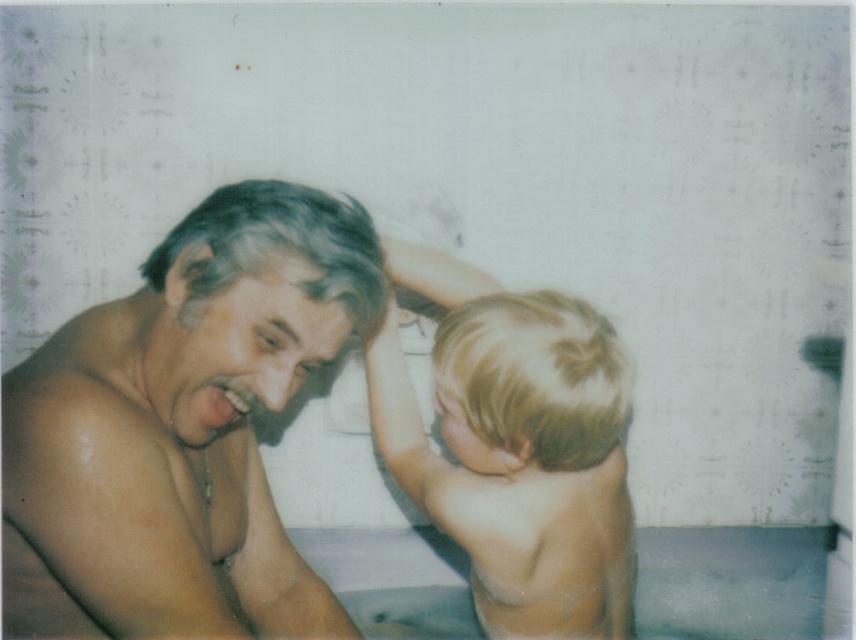
Question: Considering the real-world distances, which object is closest to the white smooth foam at lower center?

Choices:
 (A) smooth skin man at center
 (B) blonde hair at upper right

Answer: (B)

Question: Is blonde hair at upper right wider than white smooth foam at lower center?

Choices:
 (A) yes
 (B) no

Answer: (B)

Question: Can you confirm if blonde hair at upper right is positioned below white smooth foam at lower center?

Choices:
 (A) no
 (B) yes

Answer: (A)

Question: Among these points, which one is nearest to the camera?

Choices:
 (A) (597, 353)
 (B) (272, 541)

Answer: (A)

Question: Can you confirm if smooth skin man at center is thinner than blonde hair at upper right?

Choices:
 (A) yes
 (B) no

Answer: (A)

Question: Among these objects, which one is nearest to the camera?

Choices:
 (A) blonde hair at upper right
 (B) smooth skin man at center
 (C) white smooth foam at lower center

Answer: (B)